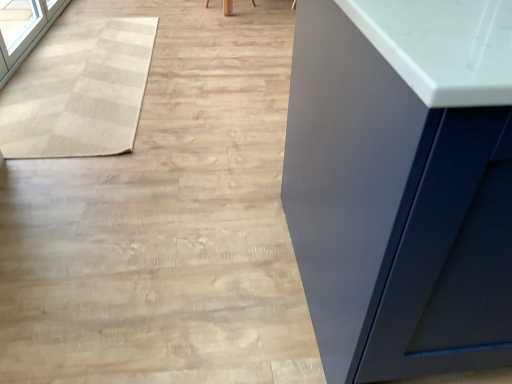
You are a GUI agent. You are given a task and a screenshot of the screen. Output one action in this format:
    pyautogui.click(x=<x>, y=<y>)
    Task: Click on the glossy dark blue cabinet at right
    Image resolution: width=512 pixels, height=384 pixels.
    Given the screenshot: What is the action you would take?
    pyautogui.click(x=402, y=184)

Image resolution: width=512 pixels, height=384 pixels. What do you see at coordinates (402, 184) in the screenshot? I see `glossy dark blue cabinet at right` at bounding box center [402, 184].

Measure the distance between glossy dark blue cabinet at right and camera.

The depth of glossy dark blue cabinet at right is 20.35 inches.

Locate an element on the screen. glossy dark blue cabinet at right is located at coordinates [x=402, y=184].